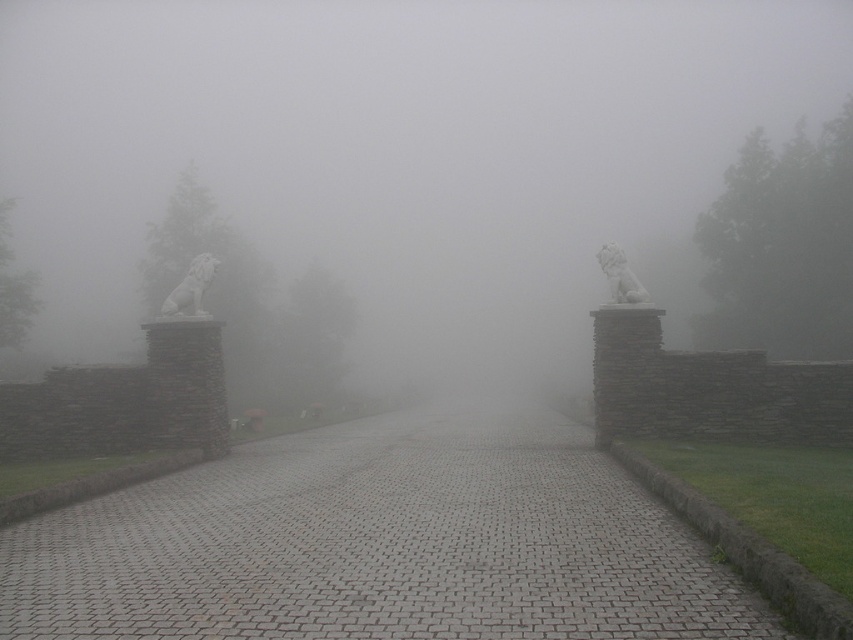
You are a delivery drone flying above the gray cobblestone path at center and the white stone lion at left. Which object is positioned higher from the ground?

The white stone lion at left is positioned higher from the ground than the gray cobblestone path at center because the gray cobblestone path at center is below the white stone lion at left.

You are standing at the origin point of the image. Where is the gray cobblestone path at center located?

The gray cobblestone path at center is located at point [380,545].

From the picture: You are a delivery drone flying over a foggy area. You need to land on the gray cobblestone path at center. However, there is a white marble lion at right nearby. Based on the scene description, can you safely land on the path without hitting the lion?

The gray cobblestone path at center is in front of the white marble lion at right, meaning the lion is positioned behind the path from your perspective. Since the path is clear in front, you can safely land on the gray cobblestone path at center without hitting the white marble lion at right.